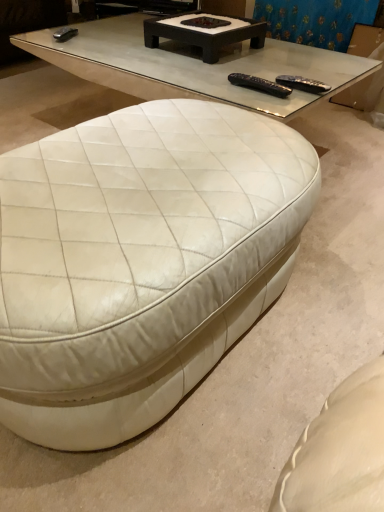
Find the location of a particular element. vacant area located to the right-hand side of white leather ottoman at lower left, which ranks as the 1th coffee table in bottom-to-top order is located at coordinates (326, 288).